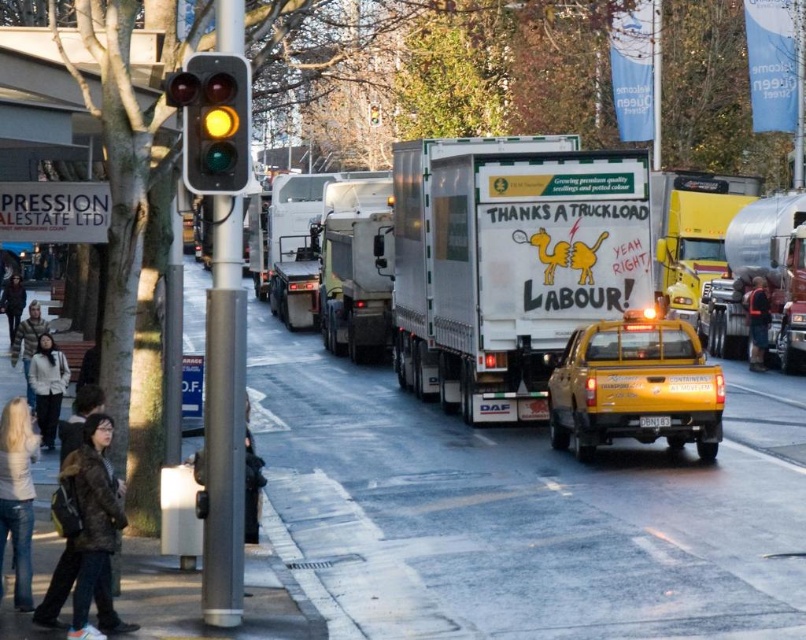
You are a delivery person trying to navigate through the busy street. You notice the matte glass traffic light at upper left and the denim jeans at lower left. Which object is smaller in size?

The matte glass traffic light at upper left is smaller in size compared to the denim jeans at lower left.

You are a delivery person trying to avoid stepping on the brown fabric backpack at lower left and the white fleece jacket at lower left. Since you need to walk through the area where both are located, which one should you step over first to navigate safely?

You should step over the brown fabric backpack at lower left first because it is closer to you than the white fleece jacket at lower left, so you encounter it sooner.